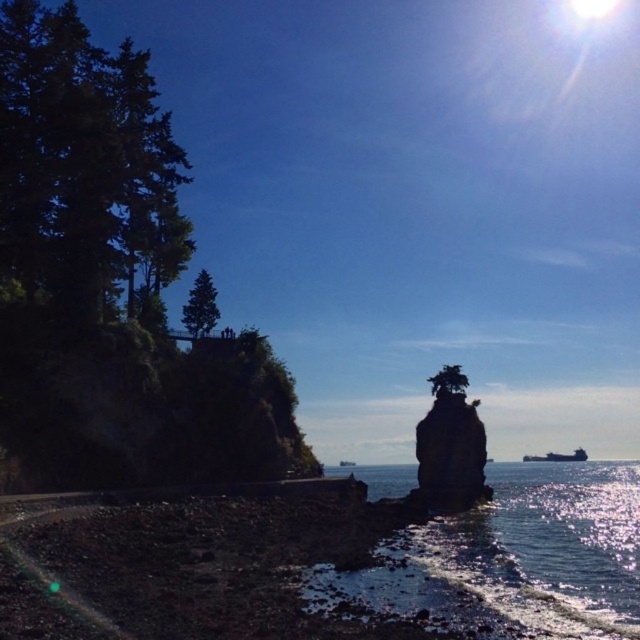
You are a photographer planning to capture a sunset shot. You have a camera tripod that can extend up to 1.5 meters. The green leafy tree at center and the metallic gray ship at lower right are in your frame. Which object should you focus on to ensure your tripod can reach their heights without exceeding its maximum extension?

The green leafy tree at center is not as tall as the metallic gray ship at lower right. Since the tripod can extend up to 1.5 meters, you should focus on the green leafy tree at center to ensure the tripod can reach its height without exceeding the limit.

Consider the image. You are standing at the shoreline in the coastal scene and want to reach a specific point. You have two options to choose from, point A at coordinates point A is point (x=106, y=83) and point B is point (x=468, y=410). Which point is closer to you?

Point A at coordinates point (x=106, y=83) is closer to you than point B at coordinates point (x=468, y=410).